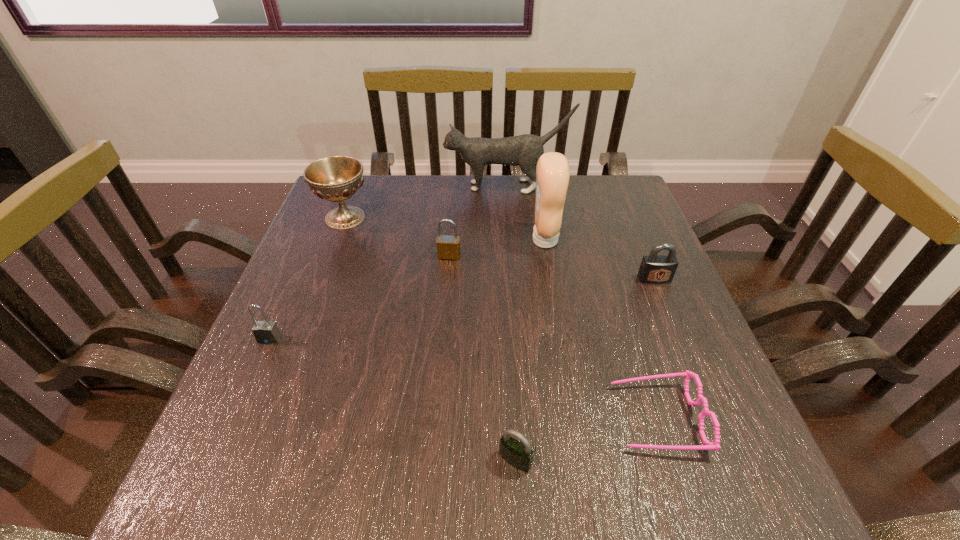
The width and height of the screenshot is (960, 540). I want to click on padlock present at the left edge, so click(x=266, y=332).

Locate an element on the screen. The width and height of the screenshot is (960, 540). padlock present at the right edge is located at coordinates [656, 269].

Locate an element on the screen. spectacles that is positioned at the right edge is located at coordinates (708, 445).

Locate an element on the screen. The width and height of the screenshot is (960, 540). object that is at the far left corner is located at coordinates (336, 178).

This screenshot has height=540, width=960. In order to click on object located at the near right corner in this screenshot , I will do `click(708, 445)`.

In the image, there is a desktop. Identify the location of vacant space at the far edge. The image size is (960, 540). (444, 191).

The height and width of the screenshot is (540, 960). In order to click on free space at the near edge of the desktop in this screenshot , I will do `click(491, 475)`.

In the image, there is a desktop. In order to click on vacant area at the left edge in this screenshot , I will do `click(292, 347)`.

The image size is (960, 540). Identify the location of free space at the right edge of the desktop. (662, 286).

Locate an element on the screen. Image resolution: width=960 pixels, height=540 pixels. free spot at the near left corner of the desktop is located at coordinates (220, 501).